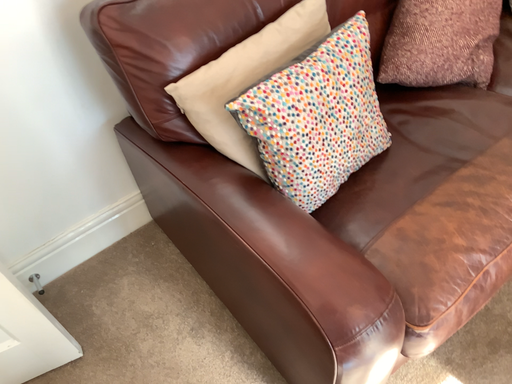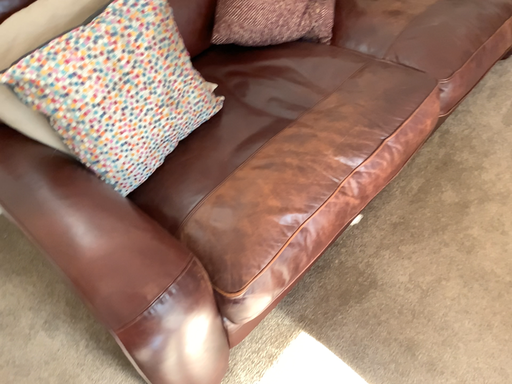
Question: How did the camera likely rotate when shooting the video?

Choices:
 (A) rotated right
 (B) rotated left

Answer: (A)